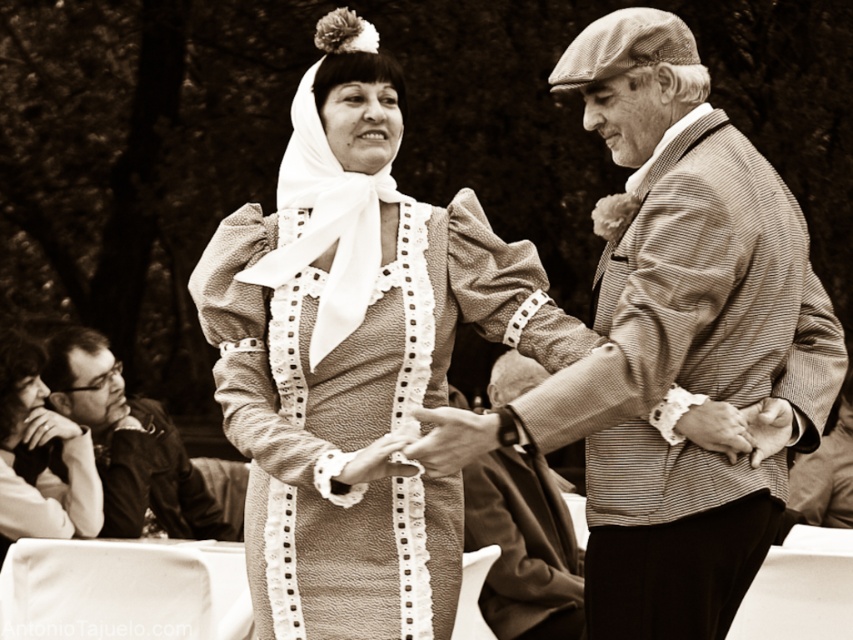
Question: Which point is farther to the camera?

Choices:
 (A) (212, 460)
 (B) (552, 618)
 (C) (770, 296)
 (D) (431, 496)

Answer: (A)

Question: Does striped woolen sweater at center appear under smooth leather hand at center?

Choices:
 (A) no
 (B) yes

Answer: (B)

Question: Estimate the real-world distances between objects in this image. Which object is farther from the smooth leather hand at center?

Choices:
 (A) matte black jacket at lower left
 (B) striped woolen jacket at center
 (C) textured beige dress at center

Answer: (A)

Question: Can you confirm if matte black jacket at lower left is wider than smooth leather hand at center?

Choices:
 (A) no
 (B) yes

Answer: (B)

Question: Which point is farther to the camera?

Choices:
 (A) (503, 477)
 (B) (380, 557)
 (C) (86, 401)
 (D) (450, 417)

Answer: (C)

Question: Can you confirm if striped woolen sweater at center is smaller than smooth leather hand at center?

Choices:
 (A) no
 (B) yes

Answer: (A)